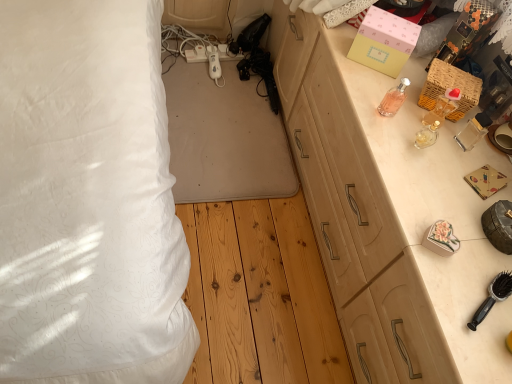
At what (x,y) coordinates should I click in order to perform the action: click on vacant space situated on the left part of pink glass bottle at upper right, positioned as the 3th perfume in right-to-left order. Please return your answer as a coordinate pair (x, y). The width and height of the screenshot is (512, 384). Looking at the image, I should click on (352, 91).